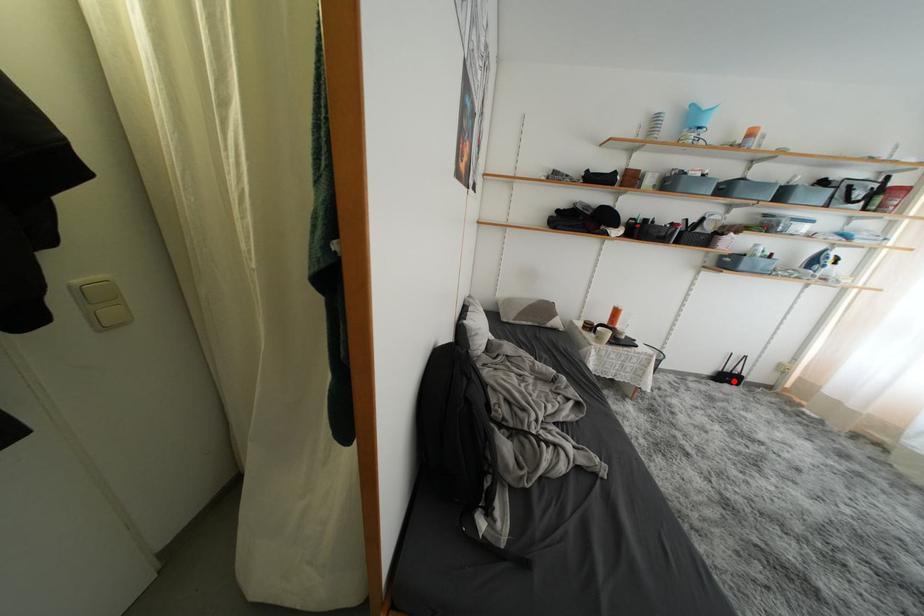
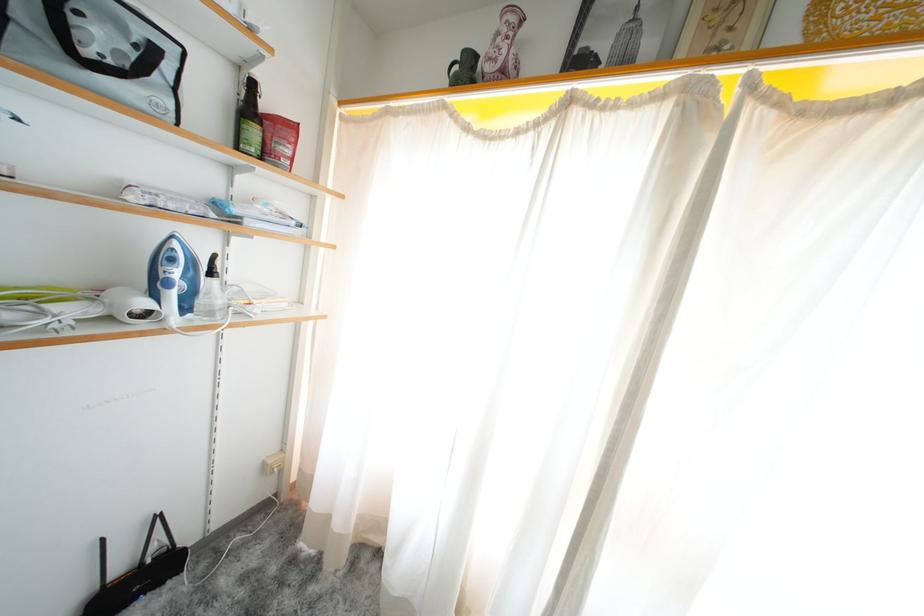
Question: I am providing you with two images of the same scene from different viewpoints. A red point is shown in image1. For the corresponding object point in image2, is it positioned nearer or farther from the camera?

Choices:
 (A) Nearer
 (B) Farther

Answer: (A)